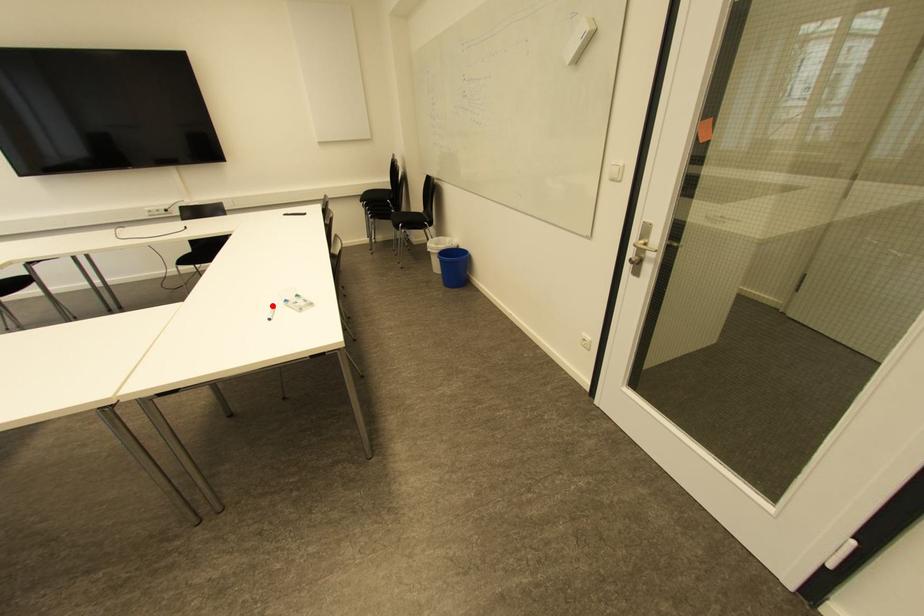
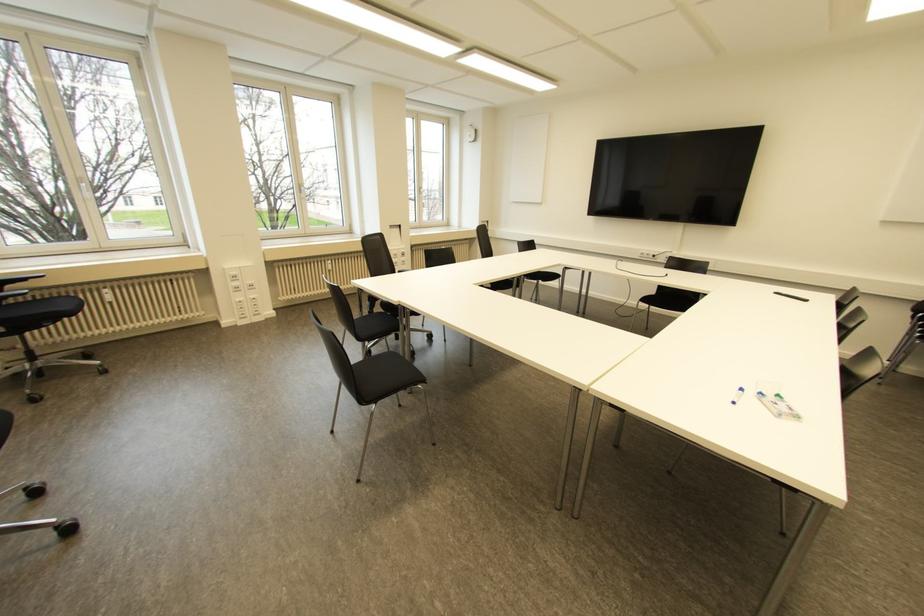
Question: I am providing you with two images of the same scene from different viewpoints. Given a red point in image1, look at the same physical point in image2. Is it:

Choices:
 (A) Closer to the viewpoint
 (B) Farther from the viewpoint

Answer: (A)